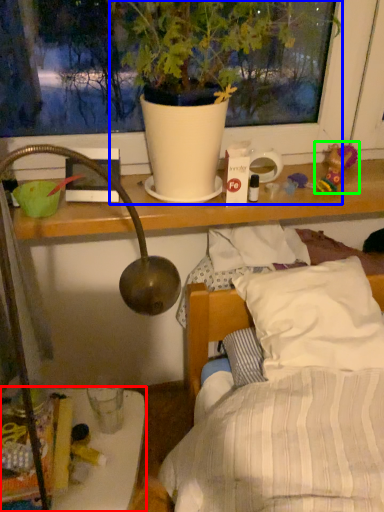
Question: Considering the real-world distances, which object is farthest from furniture (highlighted by a red box)? houseplant (highlighted by a blue box) or toy (highlighted by a green box)?

Choices:
 (A) houseplant
 (B) toy

Answer: (B)